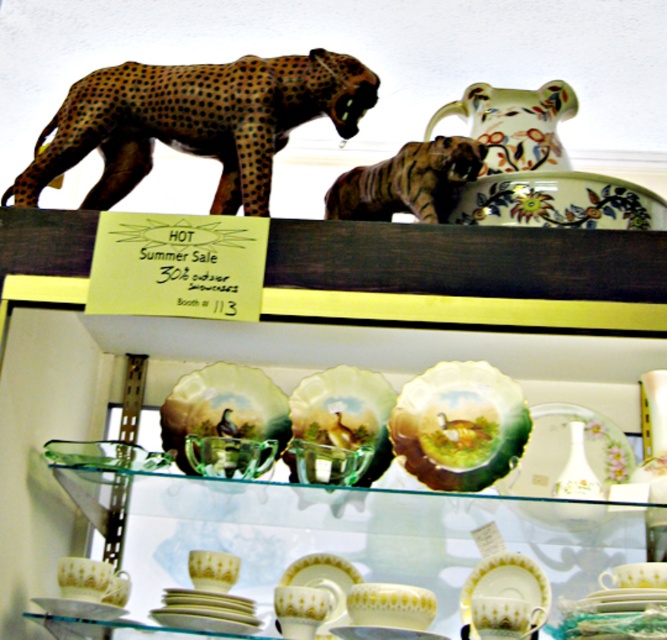
Who is taller, floral ceramic pitcher at upper right or transparent glass bowl at center?

floral ceramic pitcher at upper right is taller.

Can you confirm if floral ceramic pitcher at upper right is positioned below transparent glass bowl at center?

No, floral ceramic pitcher at upper right is not below transparent glass bowl at center.

The width and height of the screenshot is (667, 640). What do you see at coordinates (514, 124) in the screenshot?
I see `floral ceramic pitcher at upper right` at bounding box center [514, 124].

At what (x,y) coordinates should I click in order to perform the action: click on floral ceramic pitcher at upper right. Please return your answer as a coordinate pair (x, y). Looking at the image, I should click on (514, 124).

Does point (394, 196) come in front of point (468, 120)?

Yes, it is in front of point (468, 120).

Does striped ceramic tiger at upper center come in front of floral ceramic pitcher at upper right?

Yes, it is.

Between point (380, 216) and point (452, 109), which one is positioned in front?

Point (380, 216) is in front.

You are a GUI agent. You are given a task and a screenshot of the screen. Output one action in this format:
    pyautogui.click(x=<x>, y=<y>)
    Task: Click on the striped ceramic tiger at upper center
    
    Given the screenshot: What is the action you would take?
    pyautogui.click(x=408, y=180)

Between spotted wooden cheetah at upper left and green glazed plate at center, which one is positioned lower?

Positioned lower is green glazed plate at center.

Is spotted wooden cheetah at upper left positioned in front of green glazed plate at center?

No.

Where is `spotted wooden cheetah at upper left`? Image resolution: width=667 pixels, height=640 pixels. spotted wooden cheetah at upper left is located at coordinates (195, 122).

Find the location of a particular element. This screenshot has width=667, height=640. spotted wooden cheetah at upper left is located at coordinates (195, 122).